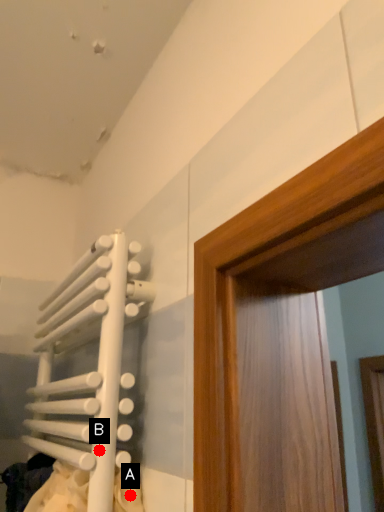
Question: Two points are circled on the image, labeled by A and B beside each circle. Which point appears farthest from the camera in this image?

Choices:
 (A) A is further
 (B) B is further

Answer: (A)